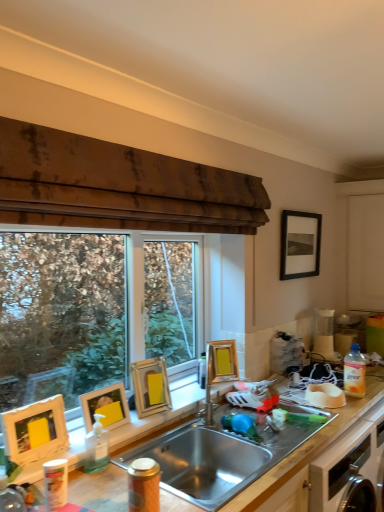
Question: From a real-world perspective, is white matte bowl at right positioned under clear plastic bottle at sink, the second bottle in the front-to-back sequence, based on gravity?

Choices:
 (A) yes
 (B) no

Answer: (A)

Question: Does white matte bowl at right have a lesser width compared to clear plastic bottle at sink, the second bottle in the front-to-back sequence?

Choices:
 (A) yes
 (B) no

Answer: (B)

Question: Is there a large distance between white matte bowl at right and clear plastic bottle at sink, the 1th bottle in the left-to-right sequence?

Choices:
 (A) no
 (B) yes

Answer: (B)

Question: Is white matte bowl at right facing away from clear plastic bottle at sink, which is the second bottle from back to front?

Choices:
 (A) yes
 (B) no

Answer: (B)

Question: Can you confirm if white matte bowl at right is smaller than clear plastic bottle at sink, which is the second bottle from back to front?

Choices:
 (A) no
 (B) yes

Answer: (A)

Question: Considering the relative sizes of white matte bowl at right and clear plastic bottle at sink, which is the second bottle from back to front, in the image provided, is white matte bowl at right bigger than clear plastic bottle at sink, which is the second bottle from back to front,?

Choices:
 (A) yes
 (B) no

Answer: (A)

Question: Considering the relative sizes of white matte bowl at right and wooden cabinet at lower center in the image provided, is white matte bowl at right smaller than wooden cabinet at lower center?

Choices:
 (A) no
 (B) yes

Answer: (B)

Question: Are white matte bowl at right and wooden cabinet at lower center located far from each other?

Choices:
 (A) no
 (B) yes

Answer: (A)

Question: Is white matte bowl at right at the left side of wooden cabinet at lower center?

Choices:
 (A) no
 (B) yes

Answer: (A)

Question: Can you confirm if white matte bowl at right is thinner than wooden cabinet at lower center?

Choices:
 (A) no
 (B) yes

Answer: (B)

Question: Is white matte bowl at right in contact with wooden cabinet at lower center?

Choices:
 (A) yes
 (B) no

Answer: (B)

Question: Is white matte bowl at right positioned in front of wooden cabinet at lower center?

Choices:
 (A) no
 (B) yes

Answer: (A)

Question: From the image's perspective, does white matte cabinet at right appear higher than white matte picture frame at left, which is the 1th picture frame from left to right?

Choices:
 (A) yes
 (B) no

Answer: (A)